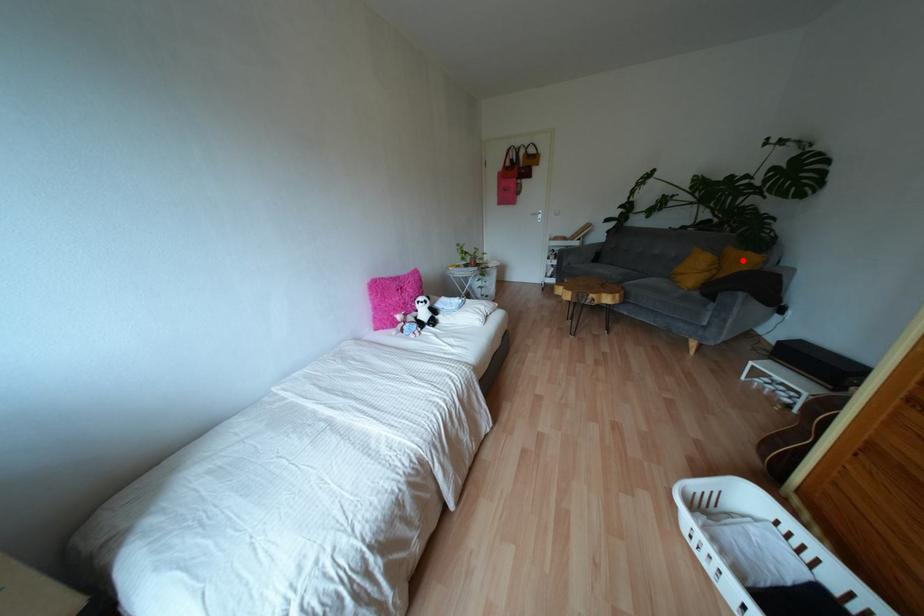
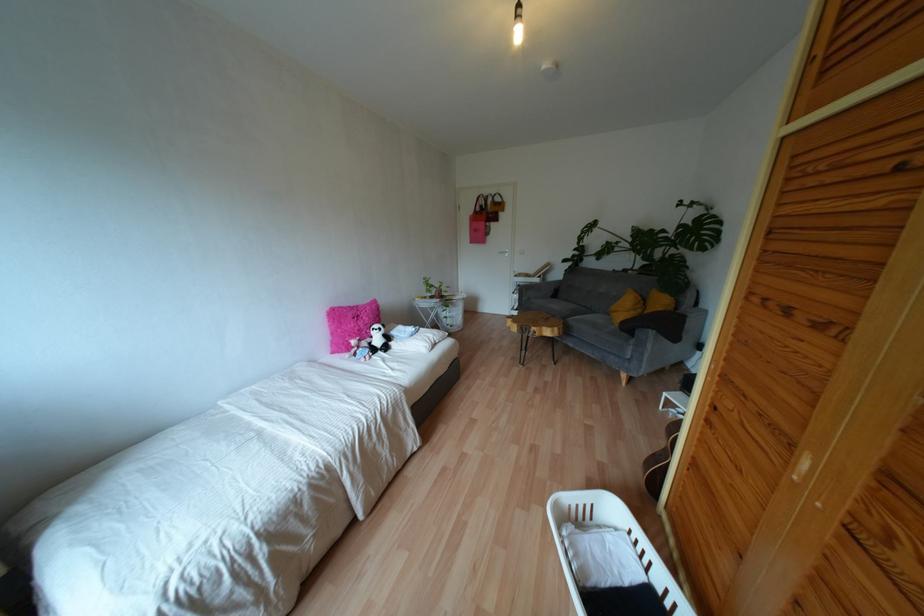
Where in the second image is the point corresponding to the highlighted location from the first image?

(660, 302)